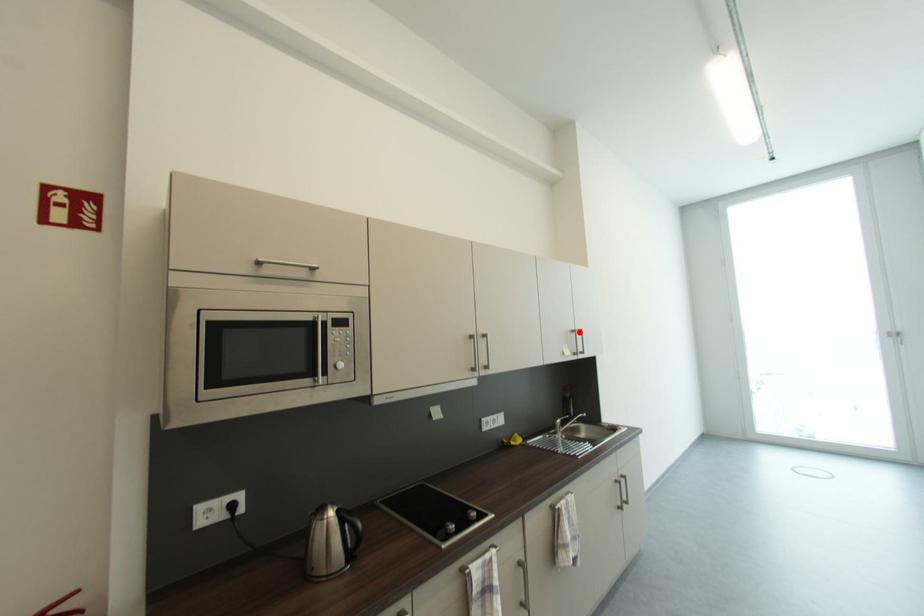
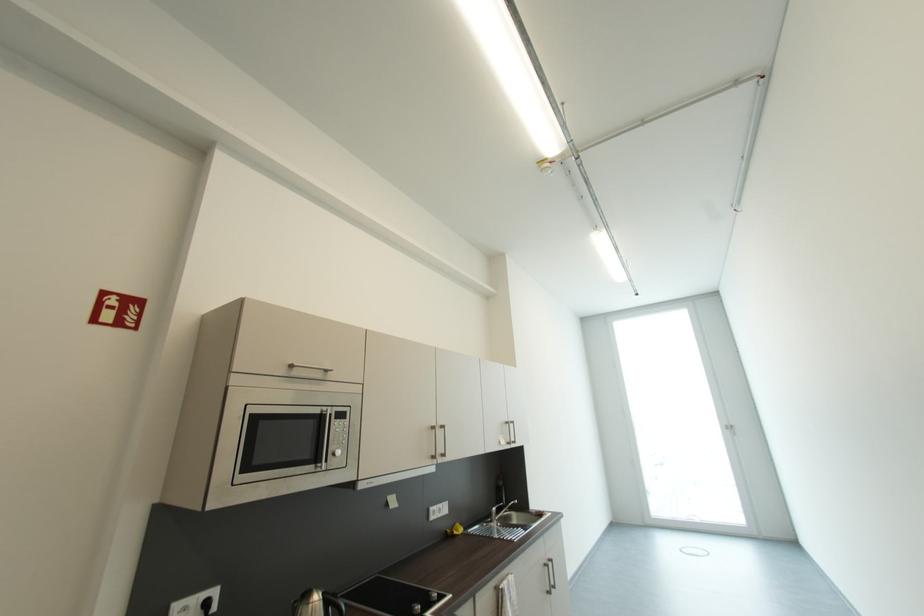
Where in the second image is the point corresponding to the highlighted location from the first image?

(513, 424)